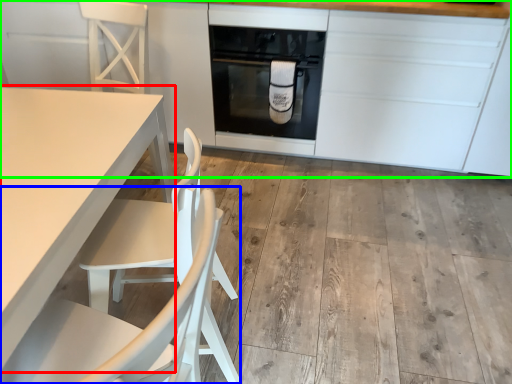
Question: Estimate the real-world distances between objects in this image. Which object is closer to table (highlighted by a red box), chair (highlighted by a blue box) or cabinetry (highlighted by a green box)?

Choices:
 (A) chair
 (B) cabinetry

Answer: (A)